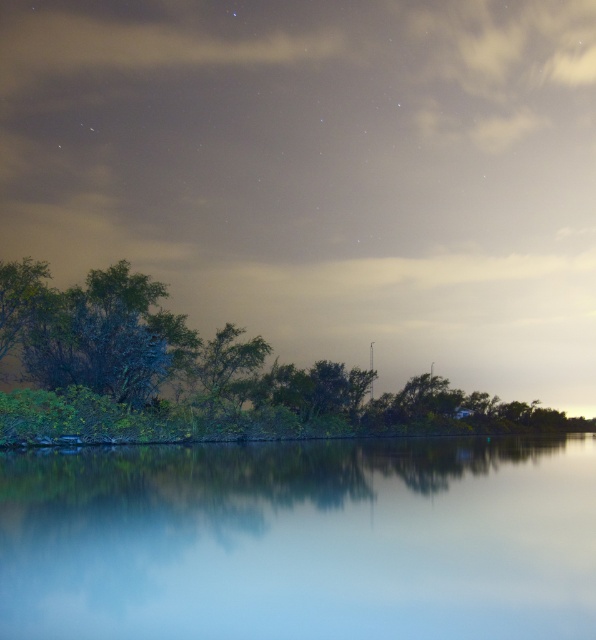
Image resolution: width=596 pixels, height=640 pixels. What do you see at coordinates (302, 540) in the screenshot? I see `transparent glass water at center` at bounding box center [302, 540].

This screenshot has height=640, width=596. Find the location of `transparent glass water at center`. transparent glass water at center is located at coordinates (302, 540).